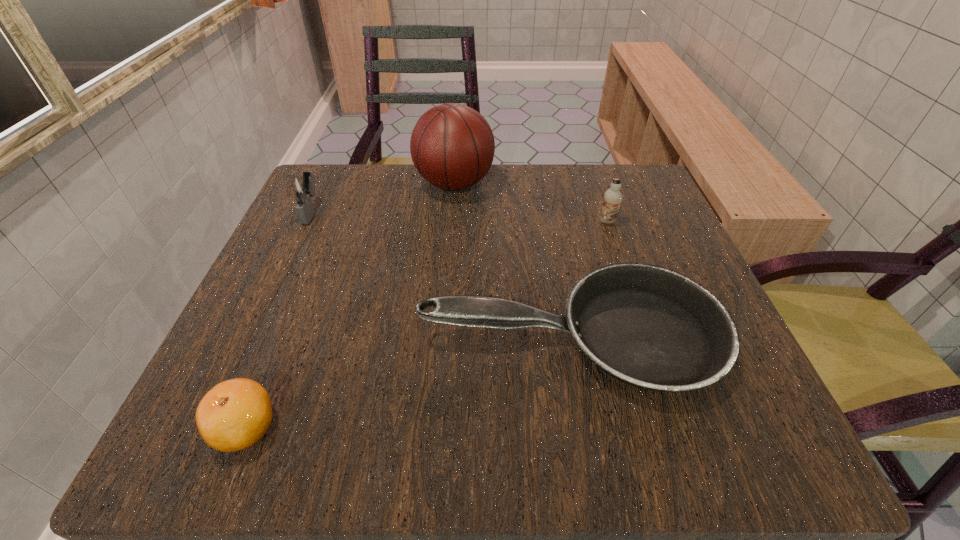
Where is `basketball positioned at the far edge`? The image size is (960, 540). basketball positioned at the far edge is located at coordinates (452, 146).

Where is `igniter that is at the far edge`? The image size is (960, 540). igniter that is at the far edge is located at coordinates (302, 188).

At what (x,y) coordinates should I click in order to perform the action: click on chocolate milk that is at the far edge. Please return your answer as a coordinate pair (x, y). Image resolution: width=960 pixels, height=540 pixels. Looking at the image, I should click on [612, 198].

Find the location of `frying pan present at the near edge`. frying pan present at the near edge is located at coordinates (647, 326).

Identify the location of clementine that is at the near edge. (235, 414).

Find the location of a particular element. The height and width of the screenshot is (540, 960). igniter that is at the left edge is located at coordinates (302, 188).

Find the location of a particular element. clementine that is at the left edge is located at coordinates (235, 414).

Image resolution: width=960 pixels, height=540 pixels. Find the location of `chocolate milk that is at the right edge`. chocolate milk that is at the right edge is located at coordinates (612, 198).

The width and height of the screenshot is (960, 540). Find the location of `frying pan that is at the right edge`. frying pan that is at the right edge is located at coordinates (647, 326).

The height and width of the screenshot is (540, 960). In order to click on object positioned at the far left corner in this screenshot , I will do `click(302, 188)`.